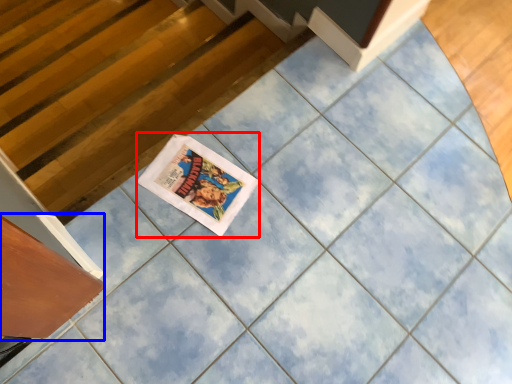
Question: Which of the following is the closest to the observer, comic book (highlighted by a red box) or drawer (highlighted by a blue box)?

Choices:
 (A) comic book
 (B) drawer

Answer: (B)